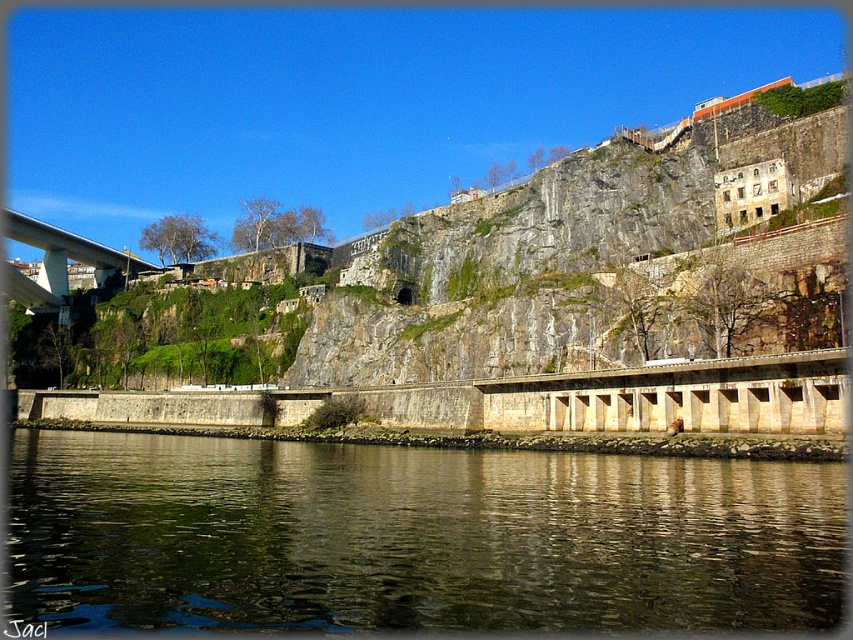
You are standing on the concrete bridge at left and want to see the dark reflective water at lower center. In which direction should you look?

The dark reflective water at lower center is to the right of the concrete bridge at left, so you should look to your right to see it.

You are a photographer planning to capture the scenic riverside view. You want to ensure that the dark reflective water at lower center and the concrete bridge at left are both visible in your shot. Based on their sizes, which object should you prioritize framing closer to the center of the photo to maintain balance?

The dark reflective water at lower center has a larger width than the concrete bridge at left, so prioritizing the dark reflective water at lower center near the center of the photo will help maintain balance between the two objects.